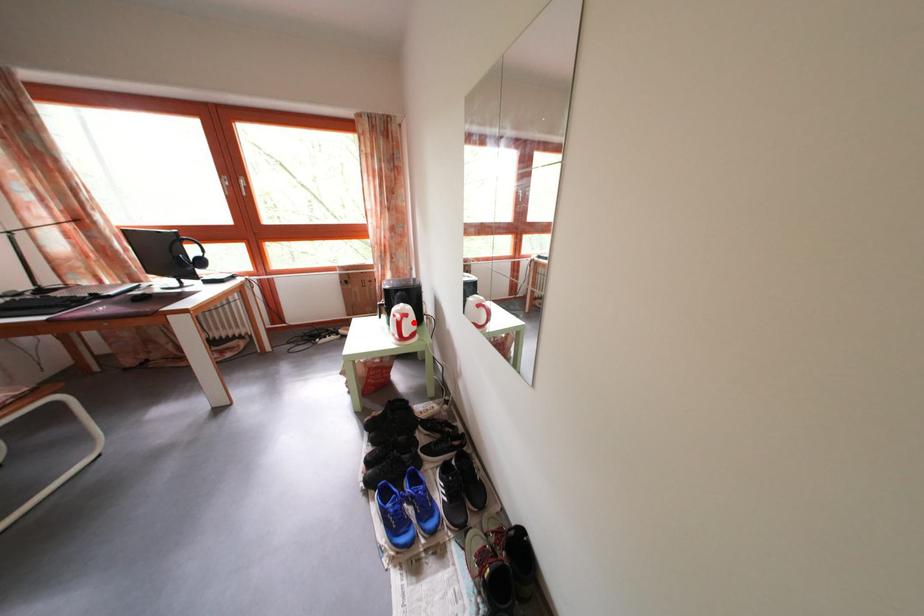
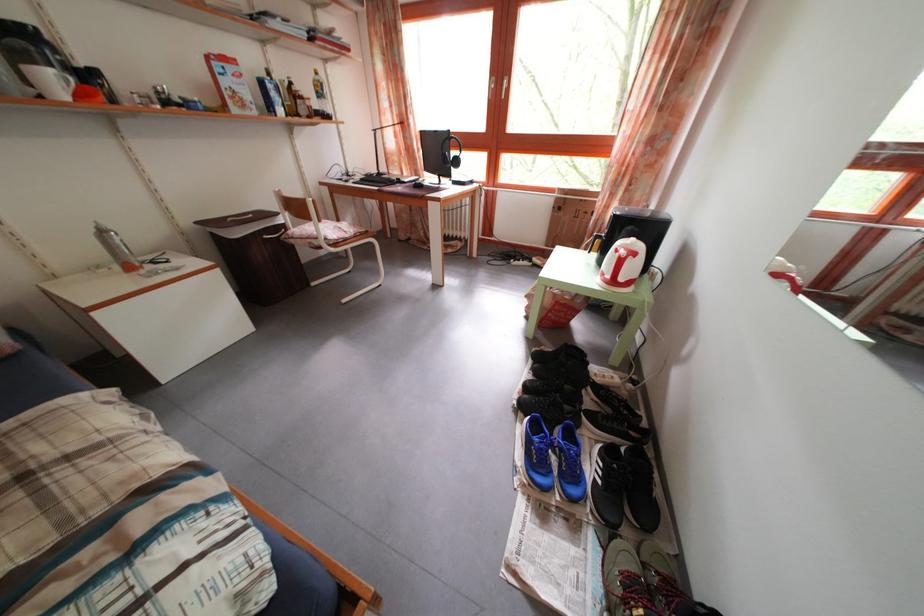
The point at the highlighted location is marked in the first image. Where is the corresponding point in the second image?

(641, 262)